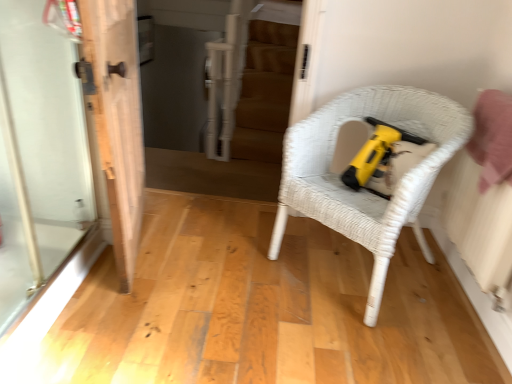
The image size is (512, 384). What are the coordinates of `vacant area situated below transparent glass screen door at left (from a real-world perspective)` in the screenshot? It's located at (61, 278).